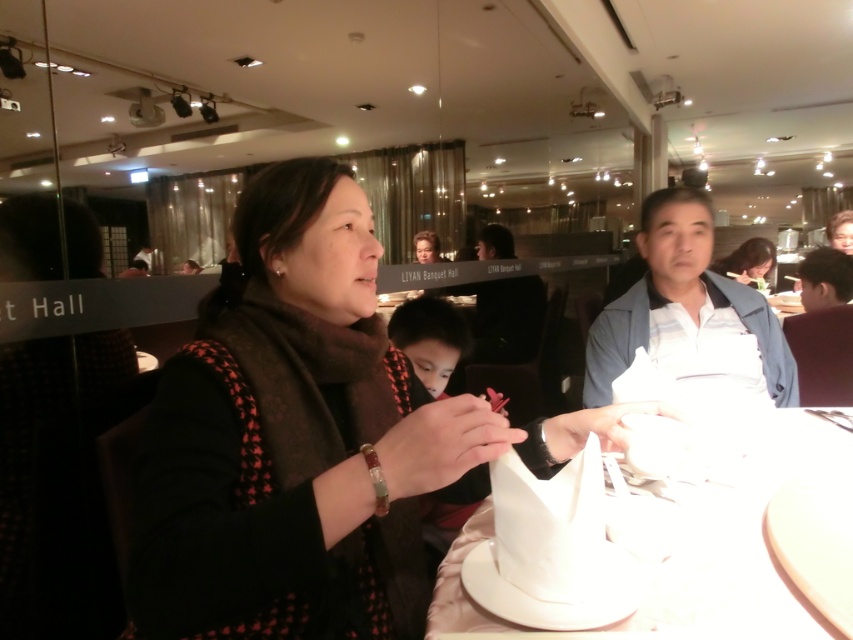
Question: Considering the relative positions of white paper plate at center and brown hair at upper right in the image provided, where is white paper plate at center located with respect to brown hair at upper right?

Choices:
 (A) right
 (B) left

Answer: (B)

Question: Is white paper plate at center further to the viewer compared to matte black hair at upper right?

Choices:
 (A) yes
 (B) no

Answer: (B)

Question: Which of the following is the farthest from the observer?

Choices:
 (A) (819, 292)
 (B) (770, 256)

Answer: (B)

Question: Can you confirm if white paper plate at center is positioned to the right of matte black hair at upper right?

Choices:
 (A) no
 (B) yes

Answer: (A)

Question: Which point is closer to the camera taking this photo?

Choices:
 (A) (657, 209)
 (B) (421, 404)
 (C) (500, 630)
 (D) (824, 257)

Answer: (C)

Question: Which object is farther from the camera taking this photo?

Choices:
 (A) matte black hair at upper right
 (B) brown hair at upper right
 (C) matte brown scarf at center

Answer: (A)